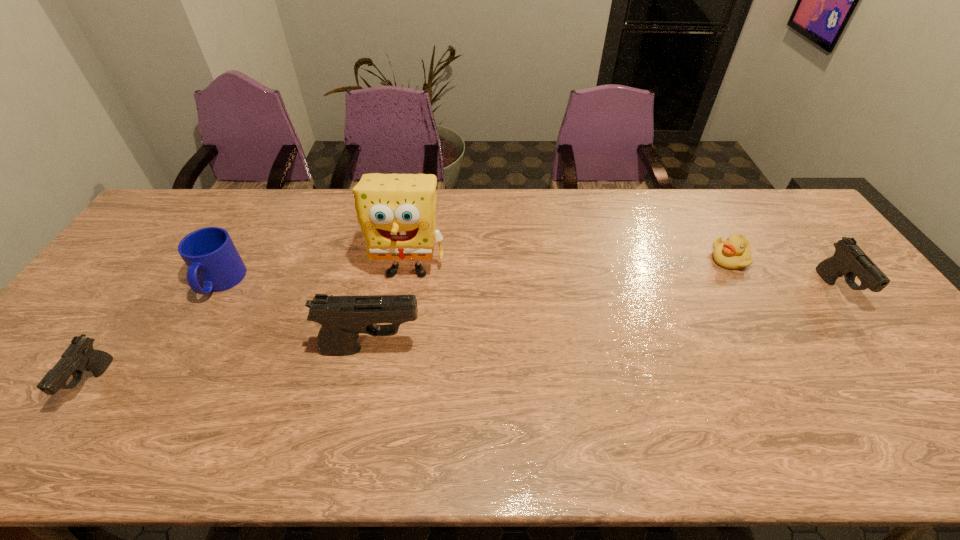
Find the location of a particular element. This screenshot has height=540, width=960. spot to insert another pistol for uniform distribution is located at coordinates (617, 318).